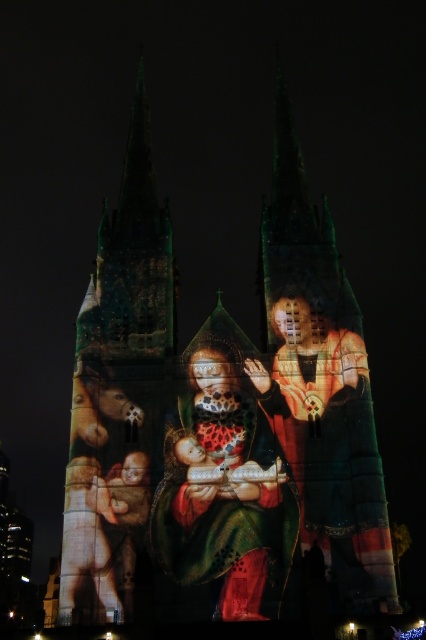
Can you confirm if matte gold and red fabric at center is smaller than matte gold robe at center?

Yes.

Which is in front, point (215, 573) or point (259, 388)?

Point (215, 573) is more forward.

At what (x,y) coordinates should I click in order to perform the action: click on matte gold and red fabric at center. Please return your answer as a coordinate pair (x, y). This screenshot has width=426, height=640. Looking at the image, I should click on (226, 492).